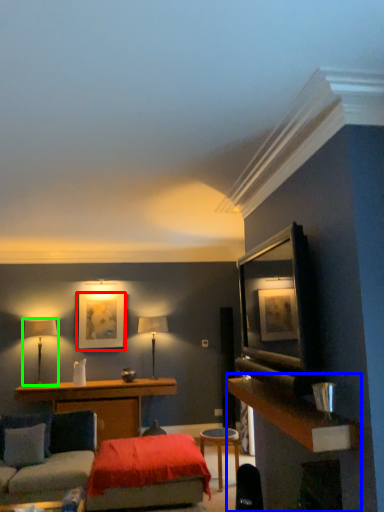
Question: Based on their relative distances, which object is nearer to picture frame (highlighted by a red box)? Choose from dresser (highlighted by a blue box) and table lamp (highlighted by a green box).

Choices:
 (A) dresser
 (B) table lamp

Answer: (B)